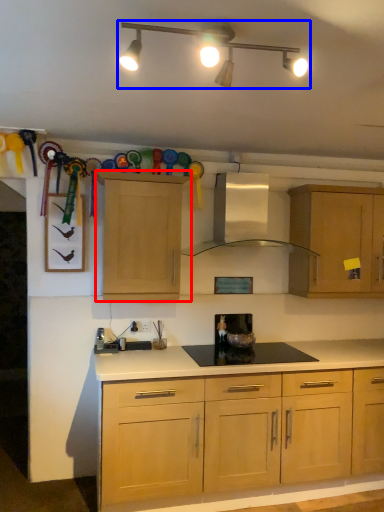
Question: Which of the following is the farthest to the observer, cabinetry (highlighted by a red box) or light fixture (highlighted by a blue box)?

Choices:
 (A) cabinetry
 (B) light fixture

Answer: (A)